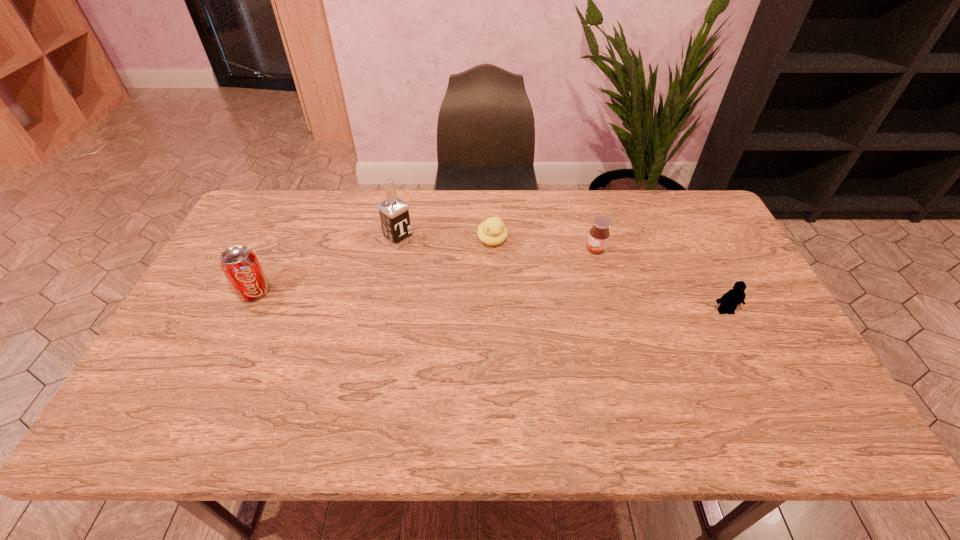
You are a GUI agent. You are given a task and a screenshot of the screen. Output one action in this format:
    pyautogui.click(x=<x>, y=<y>)
    Task: Click on the empty space that is in between the third object from left to right and the vodka
    
    Given the screenshot: What is the action you would take?
    pyautogui.click(x=445, y=240)

Where is `vacant region between the shortest object and the nearest object`? This screenshot has height=540, width=960. vacant region between the shortest object and the nearest object is located at coordinates (609, 275).

The height and width of the screenshot is (540, 960). Identify the location of free space between the tallest object and the duckling. (445, 240).

Image resolution: width=960 pixels, height=540 pixels. Identify the location of vacant area that lies between the fourth shortest object and the jam. (425, 271).

The height and width of the screenshot is (540, 960). Find the location of `free space between the nearest object and the jam`. free space between the nearest object and the jam is located at coordinates (660, 280).

Locate which object ranks second in proximity to the second nearest object. Please provide its 2D coordinates. Your answer should be formatted as a tuple, i.e. [(x, y)], where the tuple contains the x and y coordinates of a point satisfying the conditions above.

[(492, 231)]

At what (x,y) coordinates should I click in order to perform the action: click on the closest object relative to the duckling. Please return your answer as a coordinate pair (x, y). Image resolution: width=960 pixels, height=540 pixels. Looking at the image, I should click on (394, 214).

Locate an element on the screen. free location that satisfies the following two spatial constraints: 1. on the front side of the third object from right to left; 2. on the left side of the jam is located at coordinates (492, 249).

The height and width of the screenshot is (540, 960). I want to click on free point that satisfies the following two spatial constraints: 1. on the front side of the third object from right to left; 2. on the left side of the vodka, so click(x=398, y=240).

The width and height of the screenshot is (960, 540). Identify the location of vacant position in the image that satisfies the following two spatial constraints: 1. on the front side of the second object from right to left; 2. on the left side of the third object from right to left. (492, 249).